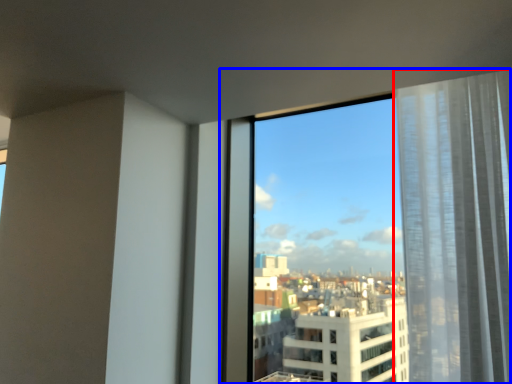
Question: Which object is further to the camera taking this photo, curtain (highlighted by a red box) or window (highlighted by a blue box)?

Choices:
 (A) curtain
 (B) window

Answer: (B)